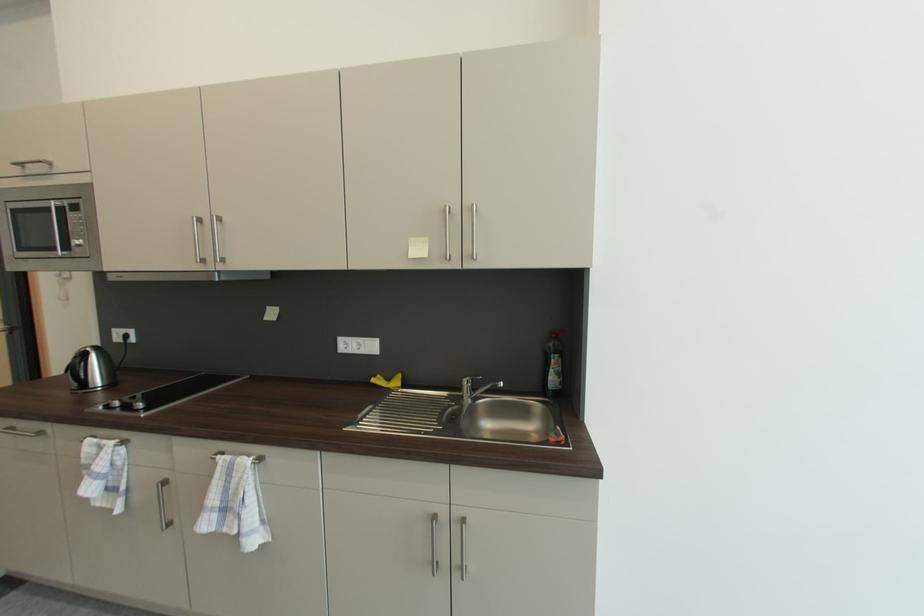
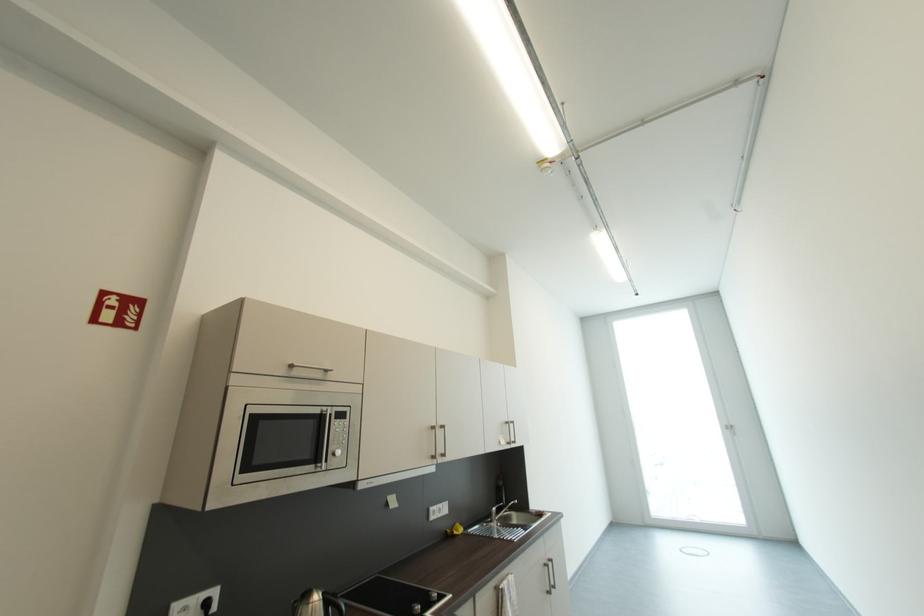
Locate, in the second image, the point that corresponds to pixel 382 378 in the first image.

(454, 533)